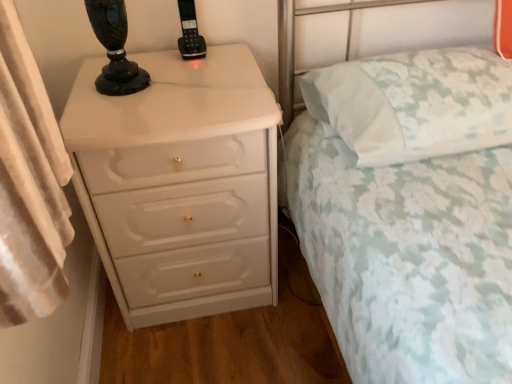
Question: Can you confirm if white floral fabric bed at center is positioned to the right of white floral fabric pillow at upper right?

Choices:
 (A) yes
 (B) no

Answer: (B)

Question: From the image's perspective, is white floral fabric bed at center beneath white floral fabric pillow at upper right?

Choices:
 (A) no
 (B) yes

Answer: (B)

Question: From the image's perspective, would you say white floral fabric bed at center is positioned over white floral fabric pillow at upper right?

Choices:
 (A) no
 (B) yes

Answer: (A)

Question: Is white floral fabric bed at center shorter than white floral fabric pillow at upper right?

Choices:
 (A) no
 (B) yes

Answer: (A)

Question: Can we say white floral fabric bed at center lies outside white floral fabric pillow at upper right?

Choices:
 (A) no
 (B) yes

Answer: (B)

Question: Is point (435, 140) closer or farther from the camera than point (190, 46)?

Choices:
 (A) closer
 (B) farther

Answer: (A)

Question: From a real-world perspective, is white floral fabric pillow at upper right positioned above or below black plastic phone at upper center?

Choices:
 (A) above
 (B) below

Answer: (B)

Question: Is white floral fabric pillow at upper right to the left or to the right of black plastic phone at upper center in the image?

Choices:
 (A) right
 (B) left

Answer: (A)

Question: Is white floral fabric pillow at upper right spatially inside black plastic phone at upper center, or outside of it?

Choices:
 (A) outside
 (B) inside

Answer: (A)

Question: From a real-world perspective, is white floral fabric pillow at upper right physically located above or below white glossy chest of drawers at left?

Choices:
 (A) below
 (B) above

Answer: (B)

Question: Based on their positions, is white floral fabric pillow at upper right located to the left or right of white glossy chest of drawers at left?

Choices:
 (A) left
 (B) right

Answer: (B)

Question: In terms of height, does white floral fabric pillow at upper right look taller or shorter compared to white glossy chest of drawers at left?

Choices:
 (A) tall
 (B) short

Answer: (B)

Question: Would you say white floral fabric pillow at upper right is inside or outside white glossy chest of drawers at left?

Choices:
 (A) outside
 (B) inside

Answer: (A)

Question: In the image, is black plastic phone at upper center on the left side or the right side of white floral fabric pillow at upper right?

Choices:
 (A) right
 (B) left

Answer: (B)

Question: Is black plastic phone at upper center wider or thinner than white floral fabric pillow at upper right?

Choices:
 (A) wide
 (B) thin

Answer: (B)